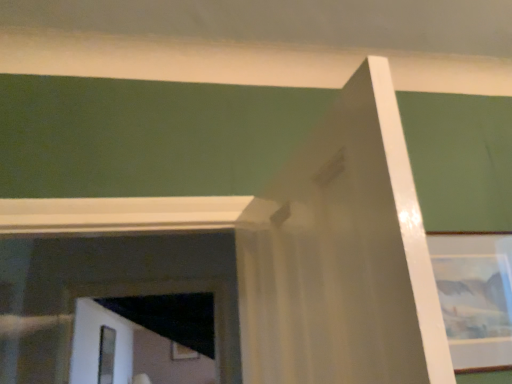
Question: Visually, is wooden picture frame at lower center, which is the first picture frame in bottom-to-top order, positioned to the left or to the right of clear glass screen door at lower left?

Choices:
 (A) right
 (B) left

Answer: (A)

Question: Is wooden picture frame at lower center, the second picture frame from the front, taller or shorter than clear glass screen door at lower left?

Choices:
 (A) tall
 (B) short

Answer: (B)

Question: Estimate the real-world distances between objects in this image. Which object is farther from the wooden picture frame at lower center, the 1th picture frame in the back-to-front sequence?

Choices:
 (A) clear glass screen door at lower left
 (B) matte glass picture frame at upper right, which appears as the 1th picture frame when viewed from the right

Answer: (B)

Question: Estimate the real-world distances between objects in this image. Which object is farther from the wooden picture frame at lower center, the first picture frame positioned from the left?

Choices:
 (A) matte glass picture frame at upper right, the 2th picture frame viewed from the left
 (B) clear glass screen door at lower left

Answer: (A)